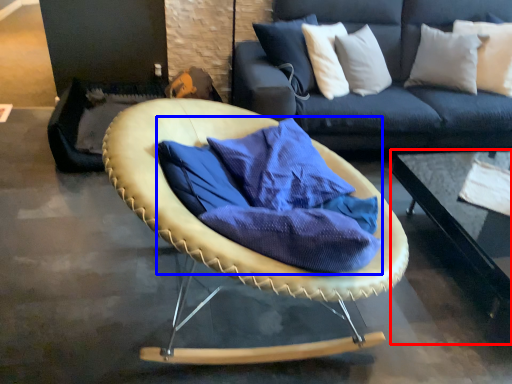
Question: Which object is further to the camera taking this photo, table (highlighted by a red box) or fabric (highlighted by a blue box)?

Choices:
 (A) table
 (B) fabric

Answer: (A)